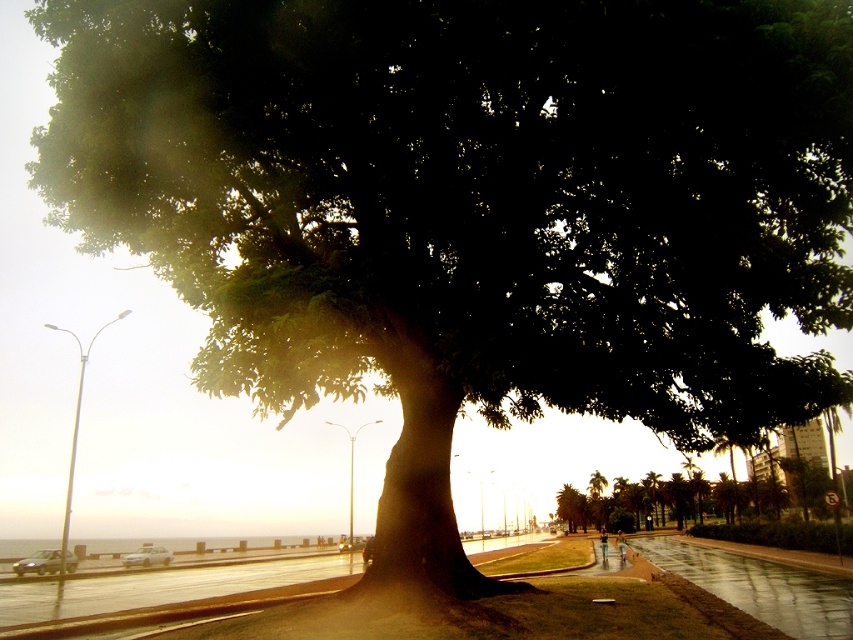
You are driving a car and want to park on the road near the large tree. There are two cars already parked there. Which car is closer to the left side of the road, the matte silver car at lower left or the white glossy car at center?

The matte silver car at lower left is to the left of the white glossy car at center, so it is closer to the left side of the road.

From the picture: You are a photographer planning to capture both the matte silver car at lower left and the white glossy car at center in a single frame. Considering their sizes, which car will appear bigger in the photo?

The matte silver car at lower left will appear bigger in the photo because it is larger in size than the white glossy car at center.